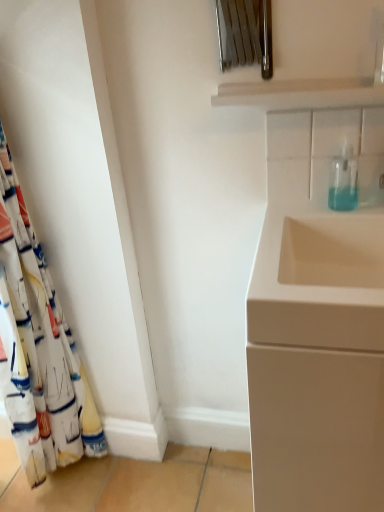
What do you see at coordinates (317, 362) in the screenshot? The width and height of the screenshot is (384, 512). I see `matte white cabinet at right` at bounding box center [317, 362].

Where is `matte white cabinet at right`? matte white cabinet at right is located at coordinates (317, 362).

What's the angular difference between transparent plastic soap dispenser at upper right and white fabric curtain at left's facing directions?

90 degrees.

Is transparent plastic soap dispenser at upper right positioned far away from white fabric curtain at left?

No.

In the image, is transparent plastic soap dispenser at upper right on the left side or the right side of white fabric curtain at left?

transparent plastic soap dispenser at upper right is to the right of white fabric curtain at left.

Between white fabric curtain at left and matte white cabinet at right, which one has less height?

Standing shorter between the two is matte white cabinet at right.

From a real-world perspective, is white fabric curtain at left located beneath matte white cabinet at right?

Incorrect, from a real-world perspective, white fabric curtain at left is higher than matte white cabinet at right.

Is point (37, 340) farther from viewer compared to point (323, 408)?

Yes, point (37, 340) is behind point (323, 408).

Can you confirm if white fabric curtain at left is smaller than transparent plastic soap dispenser at upper right?

Actually, white fabric curtain at left might be larger than transparent plastic soap dispenser at upper right.

From the picture: Is white fabric curtain at left aimed at transparent plastic soap dispenser at upper right?

Yes, white fabric curtain at left is aimed at transparent plastic soap dispenser at upper right.

From a real-world perspective, is white fabric curtain at left above or below transparent plastic soap dispenser at upper right?

In terms of real-world spatial position, white fabric curtain at left is below transparent plastic soap dispenser at upper right.

Which of these two, matte white cabinet at right or white fabric curtain at left, stands shorter?

Standing shorter between the two is matte white cabinet at right.

How far apart are matte white cabinet at right and white fabric curtain at left?

28.97 inches.

From the image's perspective, is matte white cabinet at right positioned above or below white fabric curtain at left?

matte white cabinet at right is below white fabric curtain at left.

Between matte white cabinet at right and white fabric curtain at left, which one is positioned behind?

white fabric curtain at left is more distant.

From a real-world perspective, is matte white cabinet at right physically below transparent plastic soap dispenser at upper right?

Yes, from a real-world perspective, matte white cabinet at right is below transparent plastic soap dispenser at upper right.

What's the angular difference between matte white cabinet at right and transparent plastic soap dispenser at upper right's facing directions?

0.00248 degrees.

From the image's perspective, is matte white cabinet at right located above or below transparent plastic soap dispenser at upper right?

matte white cabinet at right is situated lower than transparent plastic soap dispenser at upper right in the image.

Would you say matte white cabinet at right is outside transparent plastic soap dispenser at upper right?

Yes, matte white cabinet at right is outside of transparent plastic soap dispenser at upper right.

In terms of width, does transparent plastic soap dispenser at upper right look wider or thinner when compared to matte white cabinet at right?

Considering their sizes, transparent plastic soap dispenser at upper right looks slimmer than matte white cabinet at right.

Which of these two, transparent plastic soap dispenser at upper right or matte white cabinet at right, is bigger?

With larger size is matte white cabinet at right.

Looking at this image, from the image's perspective, which is below, transparent plastic soap dispenser at upper right or matte white cabinet at right?

From the image's view, matte white cabinet at right is below.

From a real-world perspective, is transparent plastic soap dispenser at upper right over matte white cabinet at right?

Indeed, from a real-world perspective, transparent plastic soap dispenser at upper right stands above matte white cabinet at right.

Where is `soap dispenser on the right side of white fabric curtain at left`? The width and height of the screenshot is (384, 512). soap dispenser on the right side of white fabric curtain at left is located at coordinates (343, 180).

You are a GUI agent. You are given a task and a screenshot of the screen. Output one action in this format:
    pyautogui.click(x=<x>, y=<y>)
    Task: Click on the curtain behind the matte white cabinet at right
    
    Given the screenshot: What is the action you would take?
    (x=51, y=336)

Considering their positions, is matte white cabinet at right positioned further to white fabric curtain at left than transparent plastic soap dispenser at upper right?

The object further to white fabric curtain at left is transparent plastic soap dispenser at upper right.

Based on their spatial positions, is matte white cabinet at right or white fabric curtain at left closer to transparent plastic soap dispenser at upper right?

matte white cabinet at right is closer to transparent plastic soap dispenser at upper right.

Based on the photo, based on their spatial positions, is transparent plastic soap dispenser at upper right or matte white cabinet at right further from white fabric curtain at left?

transparent plastic soap dispenser at upper right is positioned further to the anchor white fabric curtain at left.

Estimate the real-world distances between objects in this image. Which object is further from matte white cabinet at right, transparent plastic soap dispenser at upper right or white fabric curtain at left?

white fabric curtain at left is further to matte white cabinet at right.

Based on the photo, from the image, which object appears to be nearer to transparent plastic soap dispenser at upper right, white fabric curtain at left or matte white cabinet at right?

matte white cabinet at right.

Which object lies further to the anchor point matte white cabinet at right, white fabric curtain at left or transparent plastic soap dispenser at upper right?

The object further to matte white cabinet at right is white fabric curtain at left.

Locate an element on the screen. soap dispenser between white fabric curtain at left and matte white cabinet at right from left to right is located at coordinates (343, 180).